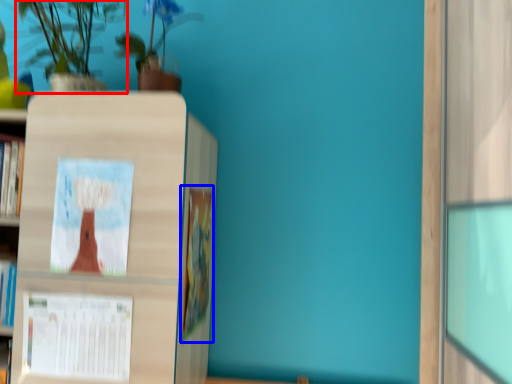
Question: Among these objects, which one is nearest to the camera, houseplant (highlighted by a red box) or book (highlighted by a blue box)?

Choices:
 (A) houseplant
 (B) book

Answer: (A)